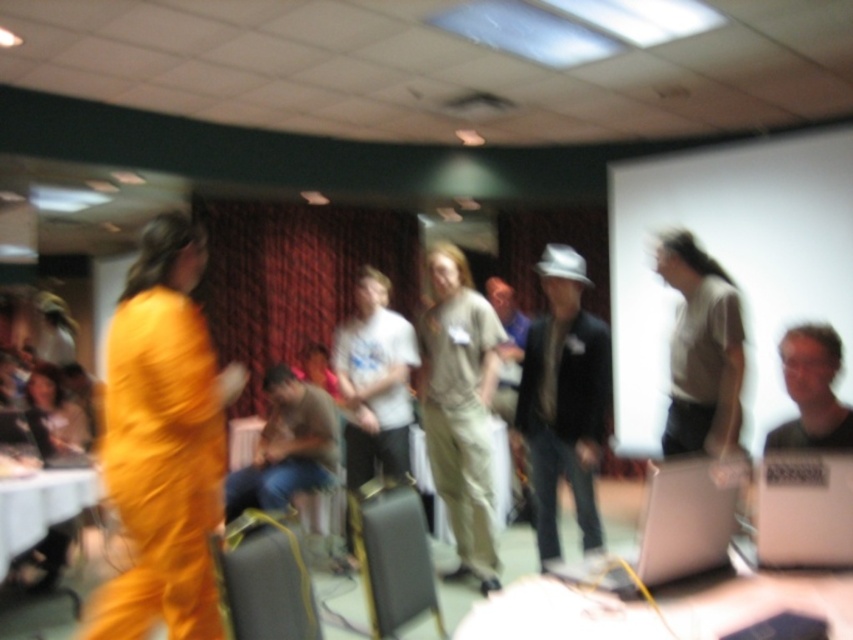
Question: Observing the image, what is the correct spatial positioning of orange fabric jumpsuit at left in reference to jeans at center?

Choices:
 (A) above
 (B) below

Answer: (A)

Question: Does matte black suit at center appear over matte gray shirt at center?

Choices:
 (A) yes
 (B) no

Answer: (B)

Question: Among these points, which one is farthest from the camera?

Choices:
 (A) (549, 380)
 (B) (366, 369)
 (C) (480, 317)

Answer: (B)

Question: Which of the following is the closest to the observer?

Choices:
 (A) (372, 365)
 (B) (720, 509)

Answer: (B)

Question: Based on their relative distances, which object is nearer to the silver metallic laptop at lower left?

Choices:
 (A) white matte shirt at center
 (B) matte black suit at center
 (C) matte gray shirt at center

Answer: (A)

Question: Does matte black suit at center appear under white matte shirt at center?

Choices:
 (A) yes
 (B) no

Answer: (A)